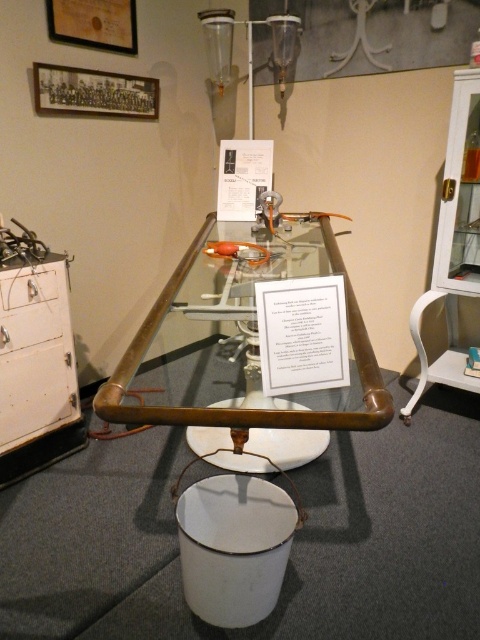
Is bronze polished table at center to the right of white matte drawer at left from the viewer's perspective?

Indeed, bronze polished table at center is positioned on the right side of white matte drawer at left.

Measure the distance from bronze polished table at center to white matte drawer at left.

bronze polished table at center is 30.69 inches away from white matte drawer at left.

What do you see at coordinates (256, 348) in the screenshot? The width and height of the screenshot is (480, 640). I see `bronze polished table at center` at bounding box center [256, 348].

Where is `bronze polished table at center`? The image size is (480, 640). bronze polished table at center is located at coordinates (256, 348).

Between white painted wood cabinet at left and white matte drawer at left, which one has less height?

white matte drawer at left

Is white painted wood cabinet at left smaller than white matte drawer at left?

Incorrect, white painted wood cabinet at left is not smaller in size than white matte drawer at left.

Locate an element on the screen. white painted wood cabinet at left is located at coordinates (35, 358).

Between bronze polished table at center and white painted wood cabinet at left, which one appears on the right side from the viewer's perspective?

Positioned to the right is bronze polished table at center.

Between point (239, 269) and point (1, 282), which one is positioned behind?

The point (239, 269) is behind.

I want to click on bronze polished table at center, so click(x=256, y=348).